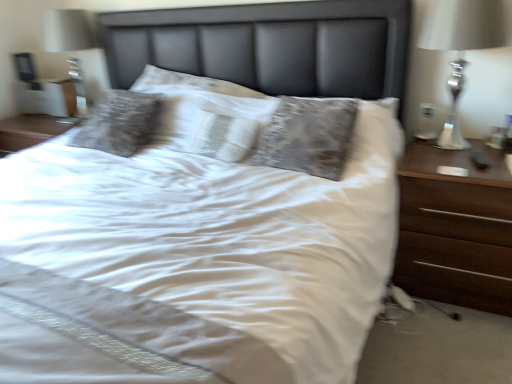
Locate an element on the screen. This screenshot has width=512, height=384. white textured pillow at center is located at coordinates (212, 123).

Does white textured pillow at center turn towards silver metallic lamp at right?

No, white textured pillow at center is not turned towards silver metallic lamp at right.

Between point (224, 106) and point (487, 6), which one is positioned behind?

The point (224, 106) is farther.

In the image, is white textured pillow at center positioned in front of or behind silver metallic lamp at right?

white textured pillow at center is positioned farther from the viewer than silver metallic lamp at right.

Is white textured pillow at center positioned far away from silver metallic lamp at right?

No.

Is there a large distance between white textured pillow at center and dark wood nightstand at right?

No.

Based on the photo, do you think white textured pillow at center is within dark wood nightstand at right, or outside of it?

white textured pillow at center lies outside dark wood nightstand at right.

Considering their positions, is white textured pillow at center located in front of or behind dark wood nightstand at right?

white textured pillow at center is behind dark wood nightstand at right.

From the image's perspective, is silver metallic lamp at right on top of white textured pillow at center?

Correct, silver metallic lamp at right appears higher than white textured pillow at center in the image.

Would you say silver metallic lamp at right contains white textured pillow at center?

Actually, white textured pillow at center is outside silver metallic lamp at right.

Is silver metallic lamp at right facing away from white textured pillow at center?

silver metallic lamp at right does not have its back to white textured pillow at center.

Locate an element on the screen. This screenshot has width=512, height=384. nightstand located below the silver metallic lamp at right (from the image's perspective) is located at coordinates (455, 229).

Does dark wood nightstand at right have a smaller size compared to silver metallic lamp at right?

Actually, dark wood nightstand at right might be larger than silver metallic lamp at right.

From the image's perspective, is dark wood nightstand at right positioned above or below silver metallic lamp at right?

Based on their image positions, dark wood nightstand at right is located beneath silver metallic lamp at right.

Based on the photo, is dark wood nightstand at right facing away from white textured pillow at center?

No.

In terms of size, does dark wood nightstand at right appear bigger or smaller than white textured pillow at center?

Considering their sizes, dark wood nightstand at right takes up more space than white textured pillow at center.

Is dark wood nightstand at right at the left side of white textured pillow at center?

No.

From a real-world perspective, which object stands above the other?

From a 3D spatial view, white textured pillow at center is above.

From a real-world perspective, who is located lower, silver metallic lamp at right or dark wood nightstand at right?

dark wood nightstand at right, from a real-world perspective.

Is silver metallic lamp at right aimed at dark wood nightstand at right?

No, silver metallic lamp at right is not oriented towards dark wood nightstand at right.

From the picture: Would you say dark wood nightstand at right is part of silver metallic lamp at right's contents?

No, dark wood nightstand at right is not a part of silver metallic lamp at right.

Image resolution: width=512 pixels, height=384 pixels. What are the coordinates of `bedside lamp located above the dark wood nightstand at right (from a real-world perspective)` in the screenshot? It's located at (461, 47).

Locate an element on the screen. pillow below the silver metallic lamp at right (from a real-world perspective) is located at coordinates (212, 123).

Locate an element on the screen. The width and height of the screenshot is (512, 384). nightstand that appears on the right of white textured pillow at center is located at coordinates (455, 229).

Based on their spatial positions, is dark wood nightstand at right or silver metallic lamp at right further from white textured pillow at center?

silver metallic lamp at right is further to white textured pillow at center.

Based on their spatial positions, is silver metallic lamp at right or white textured pillow at center further from dark wood nightstand at right?

Based on the image, white textured pillow at center appears to be further to dark wood nightstand at right.

Based on their spatial positions, is white textured pillow at center or dark wood nightstand at right closer to silver metallic lamp at right?

The object closer to silver metallic lamp at right is dark wood nightstand at right.

Which object lies nearer to the anchor point white textured pillow at center, silver metallic lamp at right or dark wood nightstand at right?

dark wood nightstand at right is closer to white textured pillow at center.

Considering their positions, is dark wood nightstand at right positioned closer to silver metallic lamp at right than white textured pillow at center?

dark wood nightstand at right lies closer to silver metallic lamp at right than the other object.

From the image, which object appears to be nearer to dark wood nightstand at right, white textured pillow at center or silver metallic lamp at right?

silver metallic lamp at right.

Identify the location of bedside lamp between white textured pillow at center and dark wood nightstand at right. (461, 47).